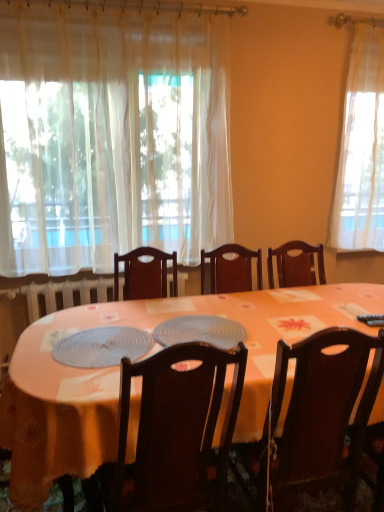
Question: Does point (139, 495) appear closer or farther from the camera than point (99, 353)?

Choices:
 (A) farther
 (B) closer

Answer: (B)

Question: In terms of width, does dark wood chair at center, which is counted as the first chair, starting from the left, look wider or thinner when compared to translucent plastic platter at center, which is the second platter from right to left?

Choices:
 (A) wide
 (B) thin

Answer: (A)

Question: Estimate the real-world distances between objects in this image. Which object is closer to the translucent plastic placemat at center, marked as the 2th platter in a left-to-right arrangement?

Choices:
 (A) translucent plastic platter at center, which is the second platter from right to left
 (B) dark wood chair at center, which ranks as the 1th chair in right-to-left order
 (C) dark wood chair at center, which is counted as the first chair, starting from the left
 (D) white sheer curtain at upper left
 (E) orange fabric table at center

Answer: (A)

Question: Which of these objects is positioned closest to the dark wood chair at center, positioned as the second chair in left-to-right order?

Choices:
 (A) translucent plastic platter at center, positioned as the 1th platter in left-to-right order
 (B) orange fabric table at center
 (C) dark wood chair at center, which is counted as the first chair, starting from the left
 (D) translucent plastic placemat at center, marked as the first platter in a right-to-left arrangement
 (E) white sheer curtain at upper left

Answer: (C)